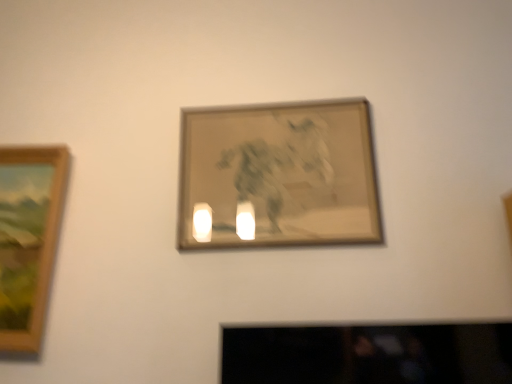
Where is `wooden framed artwork at center`? This screenshot has width=512, height=384. wooden framed artwork at center is located at coordinates (278, 176).

The height and width of the screenshot is (384, 512). What do you see at coordinates (278, 176) in the screenshot?
I see `wooden framed artwork at center` at bounding box center [278, 176].

The width and height of the screenshot is (512, 384). I want to click on wooden framed artwork at center, so click(278, 176).